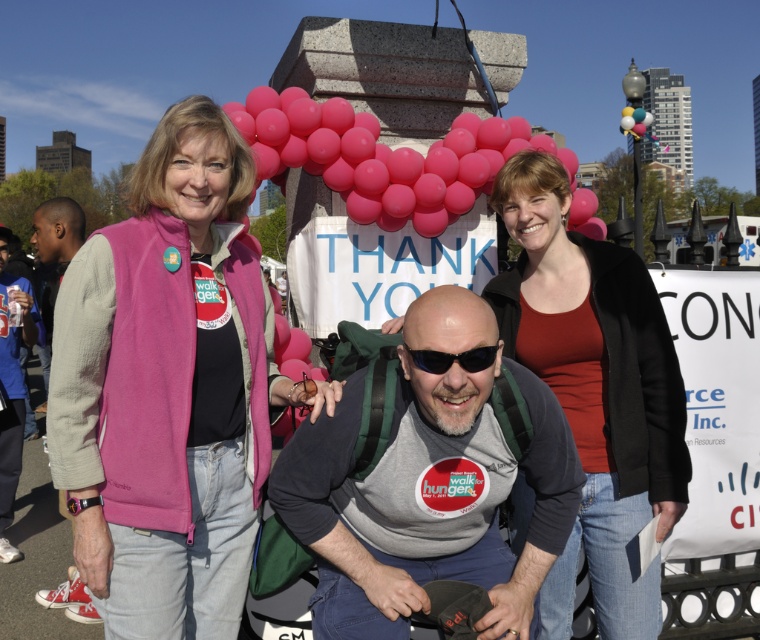
Which is below, gray fabric shirt at center or black plastic sunglasses at center?

gray fabric shirt at center is below.

This screenshot has width=760, height=640. What do you see at coordinates (428, 486) in the screenshot?
I see `gray fabric shirt at center` at bounding box center [428, 486].

Locate an element on the screen. The width and height of the screenshot is (760, 640). gray fabric shirt at center is located at coordinates (428, 486).

Does pink fleece vest at left come in front of gray fabric shirt at center?

No.

Does point (247, 172) come behind point (325, 490)?

Yes.

Is point (81, 339) closer to viewer compared to point (435, 534)?

Yes, point (81, 339) is closer to viewer.

I want to click on pink fleece vest at left, so click(x=171, y=388).

Can you confirm if pink fleece vest at left is positioned to the right of pink rubber balloons at upper center?

In fact, pink fleece vest at left is to the left of pink rubber balloons at upper center.

Does point (100, 420) lie behind point (371, 184)?

No, (100, 420) is in front of (371, 184).

Is point (147, 304) closer to viewer compared to point (293, 136)?

That is True.

Locate an element on the screen. The image size is (760, 640). pink fleece vest at left is located at coordinates point(171,388).